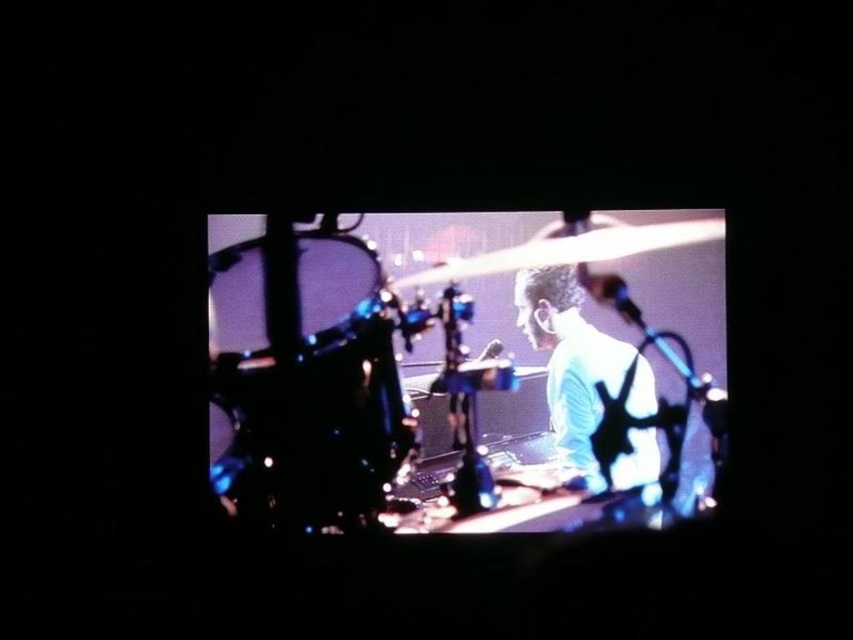
Question: Among these points, which one is nearest to the camera?

Choices:
 (A) (653, 394)
 (B) (299, 340)

Answer: (A)

Question: Does shiny black drum at left have a lesser width compared to light blue fabric at center?

Choices:
 (A) yes
 (B) no

Answer: (B)

Question: Does shiny black drum at left appear on the left side of light blue fabric at center?

Choices:
 (A) yes
 (B) no

Answer: (A)

Question: Observing the image, what is the correct spatial positioning of shiny black drum at left in reference to light blue fabric at center?

Choices:
 (A) right
 (B) left

Answer: (B)